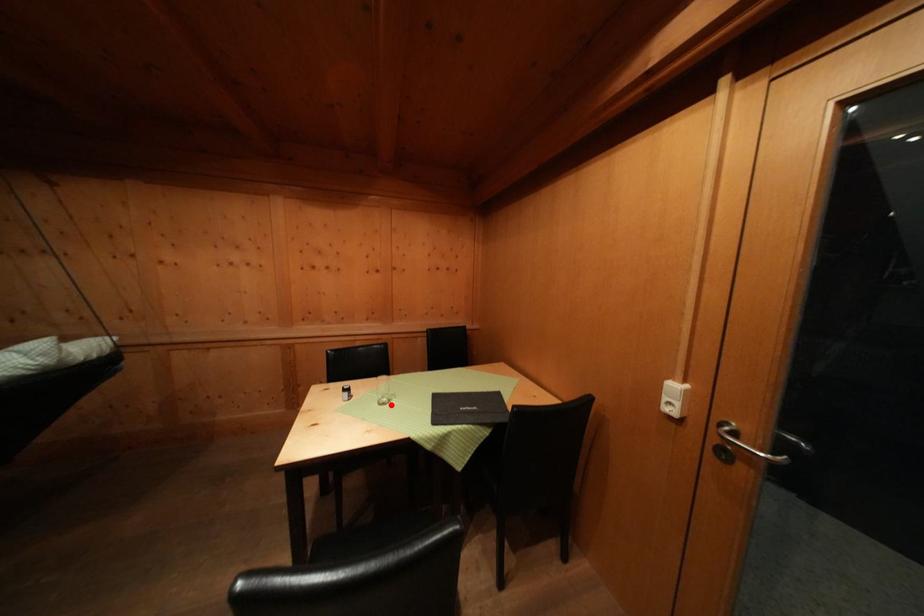
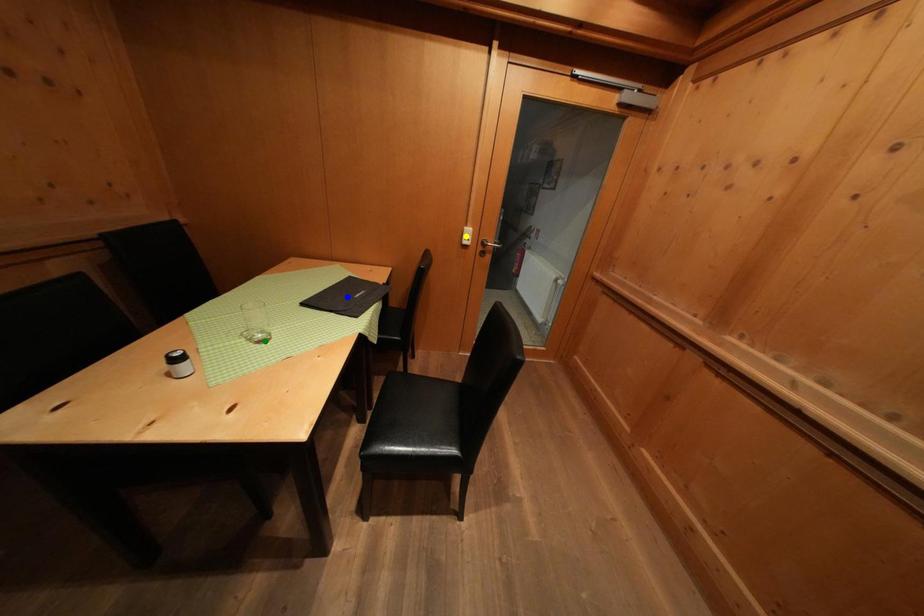
Question: I am providing you with two images of the same scene from different viewpoints. A red point is marked on the first image. You are given multiple points on the second image. Can you choose the point in image 2 that corresponds to the point in image 1?

Choices:
 (A) green point
 (B) blue point
 (C) yellow point

Answer: (A)